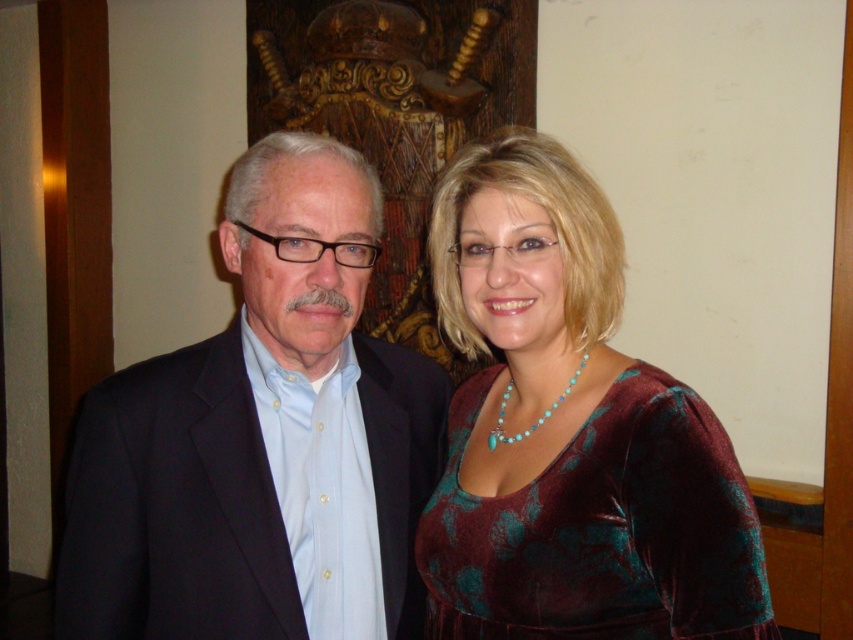
Question: Is matte black suit at left thinner than velvet dress at center?

Choices:
 (A) no
 (B) yes

Answer: (A)

Question: Is matte black suit at left to the right of velvet dress at center from the viewer's perspective?

Choices:
 (A) no
 (B) yes

Answer: (A)

Question: Which of the following is the farthest from the observer?

Choices:
 (A) (163, 362)
 (B) (453, 536)

Answer: (A)

Question: Does matte black suit at left have a smaller size compared to velvet dress at center?

Choices:
 (A) no
 (B) yes

Answer: (B)